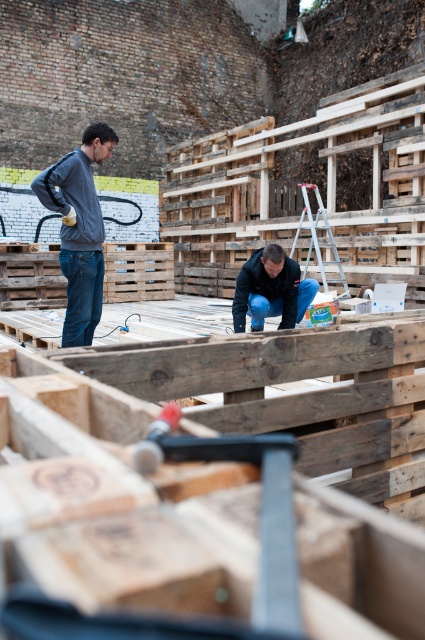
Question: Can you confirm if black rubber hammer at center is bigger than dark blue fabric at center?

Choices:
 (A) no
 (B) yes

Answer: (A)

Question: Observing the image, what is the correct spatial positioning of black rubber hammer at center in reference to matte gray hoodie at left?

Choices:
 (A) right
 (B) left

Answer: (A)

Question: Is the position of black rubber hammer at center less distant than that of dark blue fabric at center?

Choices:
 (A) no
 (B) yes

Answer: (B)

Question: Which of the following is the closest to the observer?

Choices:
 (A) matte gray hoodie at left
 (B) dark blue fabric at center
 (C) black rubber hammer at center

Answer: (C)

Question: Which object is farther from the camera taking this photo?

Choices:
 (A) black rubber hammer at center
 (B) dark blue fabric at center

Answer: (B)

Question: Considering the real-world distances, which object is farthest from the black rubber hammer at center?

Choices:
 (A) dark blue fabric at center
 (B) matte gray hoodie at left

Answer: (A)